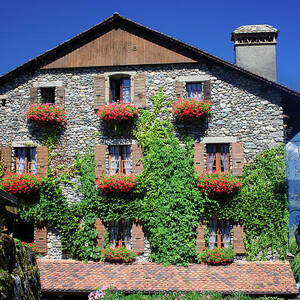
Locate an element on the screen. chimney is located at coordinates [248, 58].